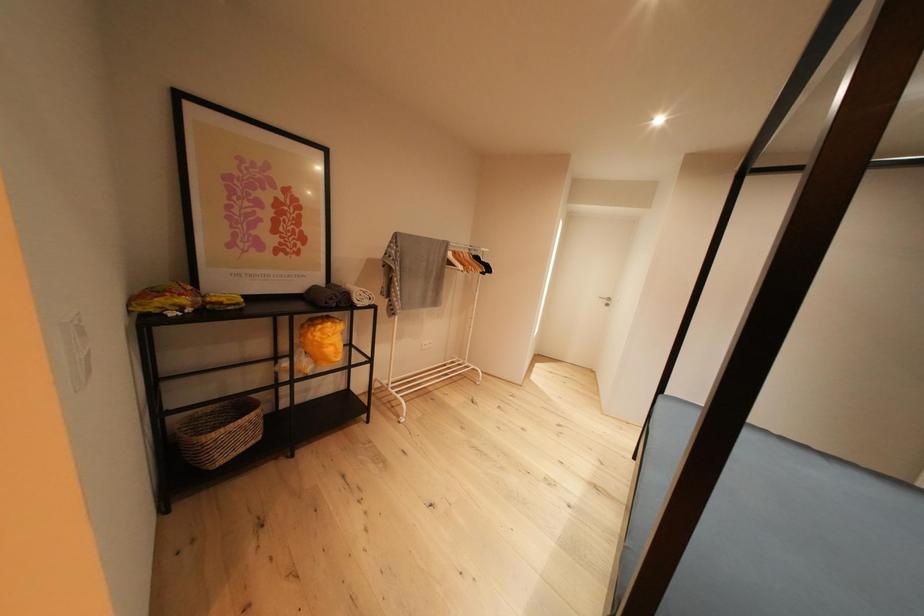
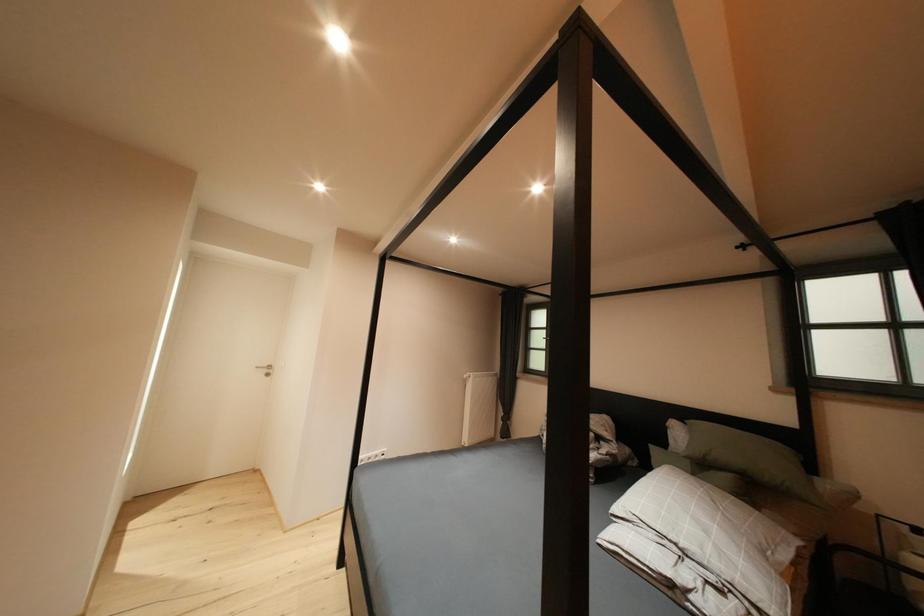
Question: The camera is either moving clockwise (left) or counter-clockwise (right) around the object. The first image is from the beginning of the video and the second image is from the end. Is the camera moving left or right when shooting the video?

Choices:
 (A) Left
 (B) Right

Answer: (A)